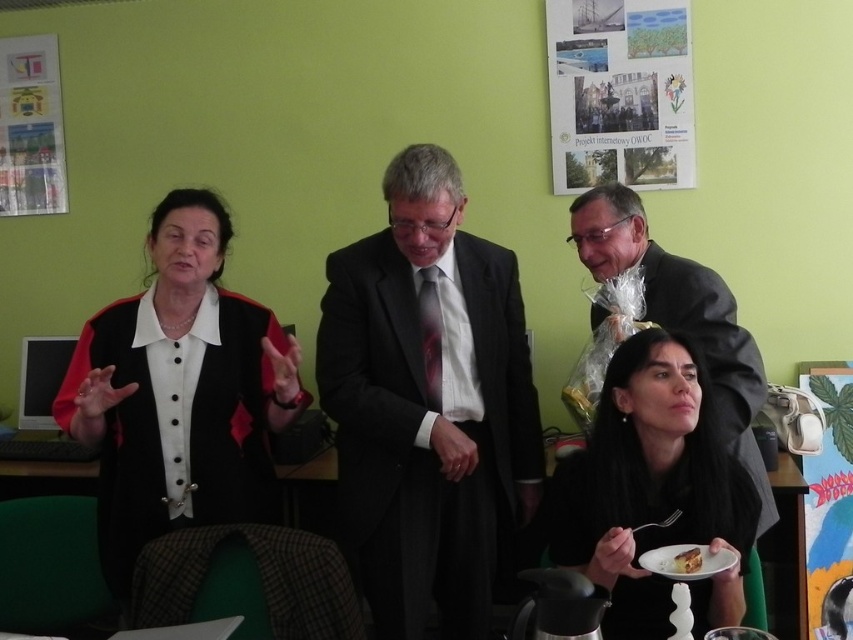
Question: Does black velvet vest at left have a larger size compared to black matte hair at lower right?

Choices:
 (A) no
 (B) yes

Answer: (B)

Question: Which of the following is the closest to the observer?

Choices:
 (A) white cake at lower right
 (B) matte black suit at center

Answer: (A)

Question: Which point is farther to the camera?

Choices:
 (A) (157, 348)
 (B) (421, 420)

Answer: (A)

Question: Does black matte hair at lower right appear under white cake at lower right?

Choices:
 (A) no
 (B) yes

Answer: (A)

Question: Which object is closer to the camera taking this photo?

Choices:
 (A) matte black suit at center
 (B) white cake at lower right
 (C) black velvet vest at left

Answer: (B)

Question: Is matte black suit at center further to camera compared to black velvet vest at left?

Choices:
 (A) no
 (B) yes

Answer: (B)